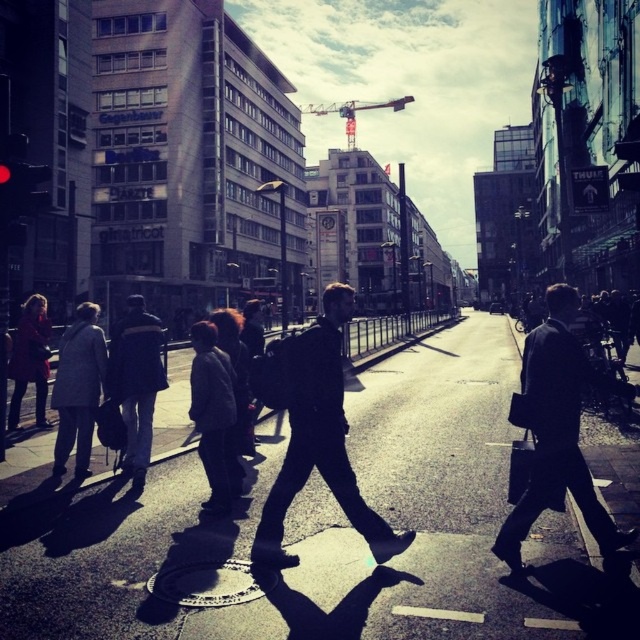
Who is taller, dark suit at center or dark gray jacket at left?

With more height is dark suit at center.

Is dark suit at center thinner than dark gray jacket at left?

In fact, dark suit at center might be wider than dark gray jacket at left.

This screenshot has width=640, height=640. Describe the element at coordinates (557, 429) in the screenshot. I see `dark suit at center` at that location.

In order to click on dark suit at center in this screenshot , I will do `click(557, 429)`.

Which is more to the right, dark gray coat at left or metallic construction crane at upper center?

Positioned to the right is metallic construction crane at upper center.

Looking at this image, is dark gray coat at left smaller than metallic construction crane at upper center?

Indeed, dark gray coat at left has a smaller size compared to metallic construction crane at upper center.

Who is more distant from viewer, (97,324) or (348,108)?

The point (348,108) is behind.

Locate an element on the screen. The width and height of the screenshot is (640, 640). dark gray coat at left is located at coordinates (77, 388).

Find the location of a particular element. The image size is (640, 640). dark gray jacket at center is located at coordinates (212, 416).

Is dark gray jacket at center closer to camera compared to dark brown leather jacket at left?

Yes, it is.

Measure the distance between point (212, 451) and camera.

Point (212, 451) is 6.53 meters away from camera.

The width and height of the screenshot is (640, 640). I want to click on dark gray jacket at center, so (212, 416).